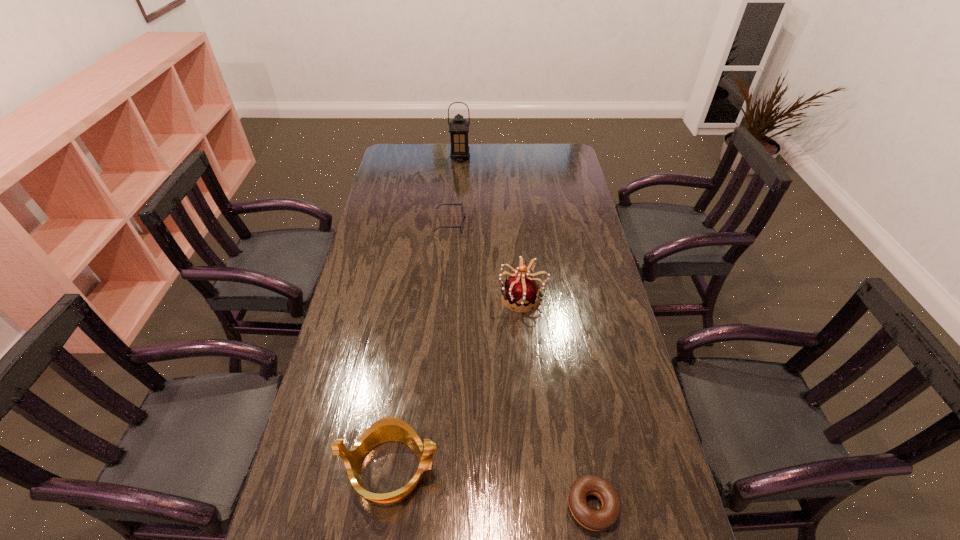
In order to click on vacant space at the right edge of the desktop in this screenshot , I will do `click(587, 211)`.

At what (x,y) coordinates should I click in order to perform the action: click on vacant space at the far left corner of the desktop. Please return your answer as a coordinate pair (x, y). Image resolution: width=960 pixels, height=540 pixels. Looking at the image, I should click on (419, 147).

Find the location of a particular element. free space between the farther tiara and the tallest object is located at coordinates (492, 227).

What are the coordinates of `free spot between the shorter tiara and the doughnut` in the screenshot? It's located at (492, 487).

Where is `vacant space that's between the nearer tiara and the farthest object`? The height and width of the screenshot is (540, 960). vacant space that's between the nearer tiara and the farthest object is located at coordinates (426, 313).

At what (x,y) coordinates should I click in order to perform the action: click on unoccupied position between the doughnut and the nearer tiara. Please return your answer as a coordinate pair (x, y). This screenshot has height=540, width=960. Looking at the image, I should click on (492, 487).

The height and width of the screenshot is (540, 960). I want to click on vacant region between the doughnut and the farther tiara, so click(558, 401).

Where is `unoccupied area between the shorter tiara and the doughnut`? Image resolution: width=960 pixels, height=540 pixels. unoccupied area between the shorter tiara and the doughnut is located at coordinates (492, 487).

Locate an element on the screen. vacant space that's between the second farthest object and the doughnut is located at coordinates (521, 365).

Where is `empty space between the shorter tiara and the tallest object`? The width and height of the screenshot is (960, 540). empty space between the shorter tiara and the tallest object is located at coordinates (426, 313).